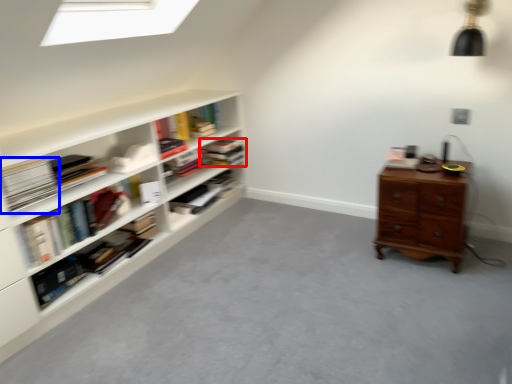
Question: Which point is closer to the camera, book (highlighted by a red box) or paperback book (highlighted by a blue box)?

Choices:
 (A) book
 (B) paperback book

Answer: (B)